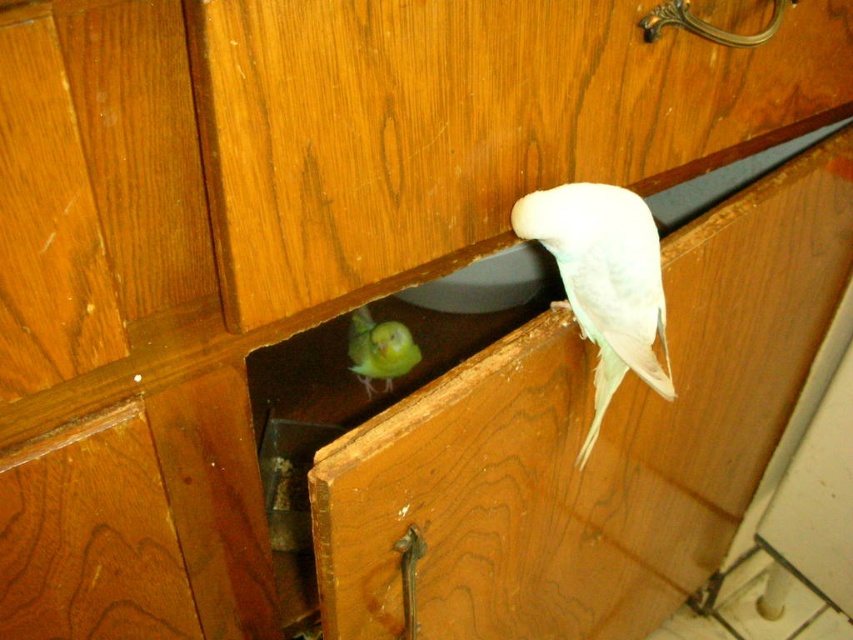
Question: Where is green matte drawer at center located in relation to white feathered parrot at upper right in the image?

Choices:
 (A) below
 (B) above

Answer: (A)

Question: Which point appears closest to the camera in this image?

Choices:
 (A) (701, 472)
 (B) (611, 189)

Answer: (B)

Question: Which of the following is the closest to the observer?

Choices:
 (A) (352, 364)
 (B) (640, 301)

Answer: (B)

Question: Is white feathered parrot at upper right bigger than green matte parrot at lower center?

Choices:
 (A) yes
 (B) no

Answer: (A)

Question: Which point appears closest to the camera in this image?

Choices:
 (A) (354, 348)
 (B) (786, 230)

Answer: (B)

Question: Considering the relative positions of green matte drawer at center and white feathered parrot at upper right in the image provided, where is green matte drawer at center located with respect to white feathered parrot at upper right?

Choices:
 (A) above
 (B) below

Answer: (B)